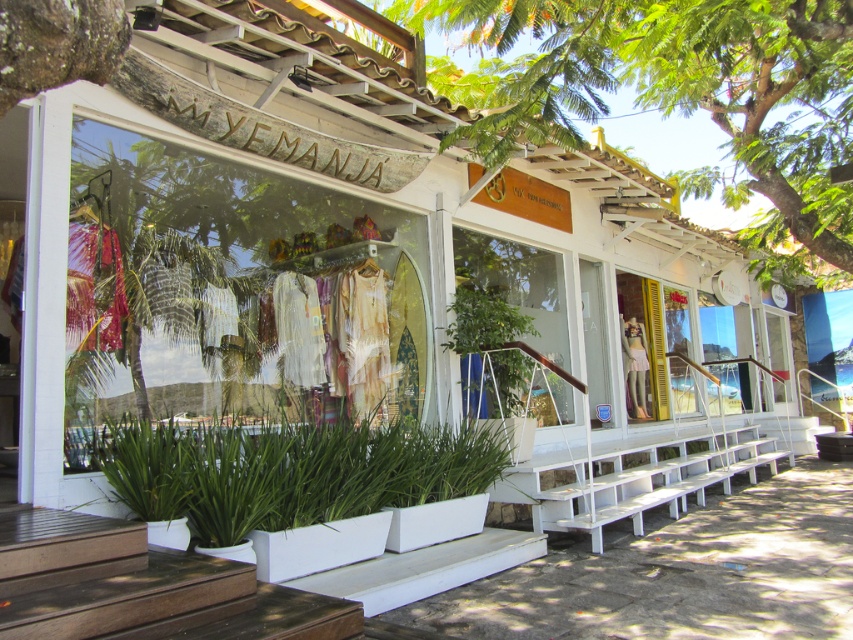
Question: Is green leafy tree at upper center below green leafy plant at lower center?

Choices:
 (A) no
 (B) yes

Answer: (A)

Question: Which is nearer to the green leafy tree at upper center?

Choices:
 (A) matte glass shop window at center
 (B) green leafy plant at lower center

Answer: (A)

Question: Which object is farther from the camera taking this photo?

Choices:
 (A) green leafy plant at lower center
 (B) green leafy tree at upper center

Answer: (B)

Question: Estimate the real-world distances between objects in this image. Which object is closer to the green leafy plant at lower center?

Choices:
 (A) green leafy tree at upper center
 (B) matte glass shop window at center

Answer: (B)

Question: Is green leafy tree at upper center closer to camera compared to green leafy plant at lower center?

Choices:
 (A) yes
 (B) no

Answer: (B)

Question: Does green leafy tree at upper center have a larger size compared to green leafy plant at lower center?

Choices:
 (A) no
 (B) yes

Answer: (B)